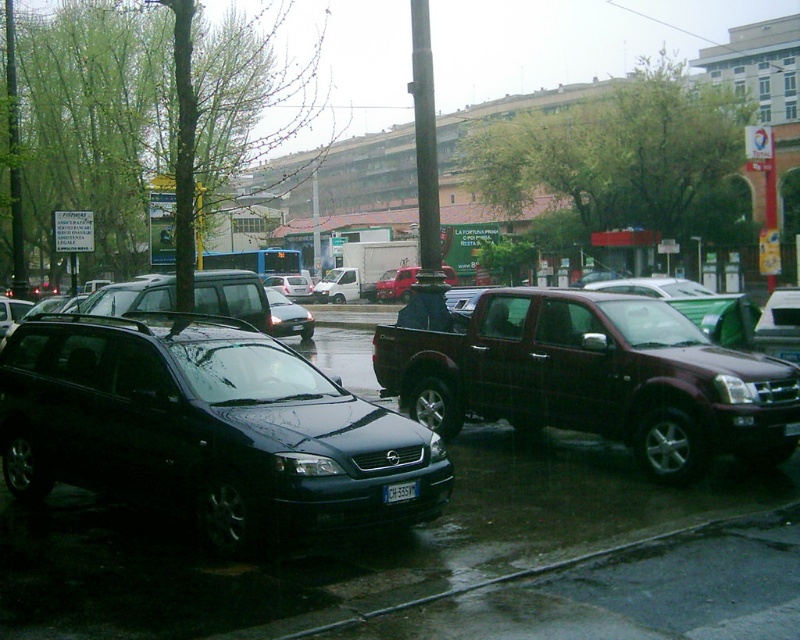
Question: In this image, where is metallic red truck at center located relative to black plastic license plate at center?

Choices:
 (A) left
 (B) right

Answer: (B)

Question: Which point is farther to the camera?

Choices:
 (A) dark red metallic pickup truck at center
 (B) black plastic license plate at center
 (C) silver metallic sedan at center
 (D) shiny black sedan at center

Answer: (C)

Question: Which object appears closest to the camera in this image?

Choices:
 (A) shiny black sedan at center
 (B) metallic red truck at center
 (C) silver metallic sedan at center
 (D) black plastic license plate at center

Answer: (D)

Question: Is dark red metallic pickup truck at center below black plastic license plate at center?

Choices:
 (A) yes
 (B) no

Answer: (B)

Question: Is dark red metallic pickup truck at center closer to camera compared to black plastic license plate at center?

Choices:
 (A) no
 (B) yes

Answer: (A)

Question: Which of the following is the farthest from the observer?

Choices:
 (A) dark red metallic pickup truck at center
 (B) silver metallic sedan at center
 (C) black plastic license plate at center

Answer: (B)